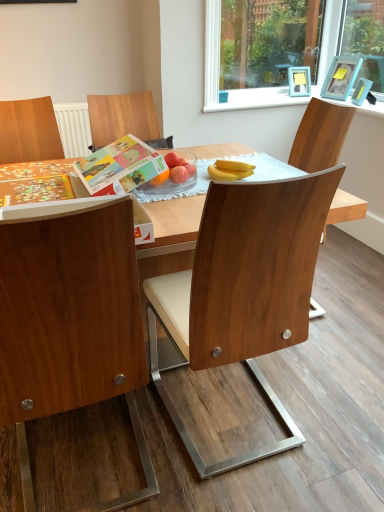
The height and width of the screenshot is (512, 384). In order to click on vacant space in between wooden chair at left, placed as the 2th chair when sorted from right to left, and wooden chair at center, the 2th chair when ordered from left to right in this screenshot , I will do `click(169, 435)`.